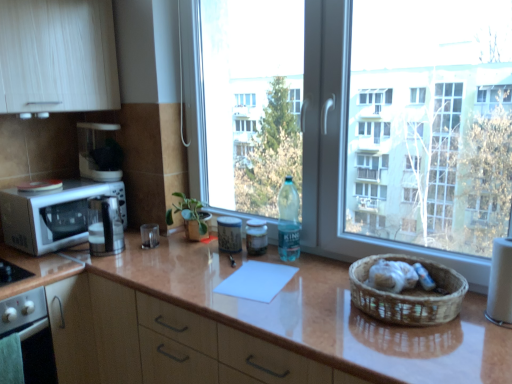
Find the location of a particular element. unoccupied region to the right of matte glass jar at center, marked as the 3th appliance in a top-to-bottom arrangement is located at coordinates (296, 259).